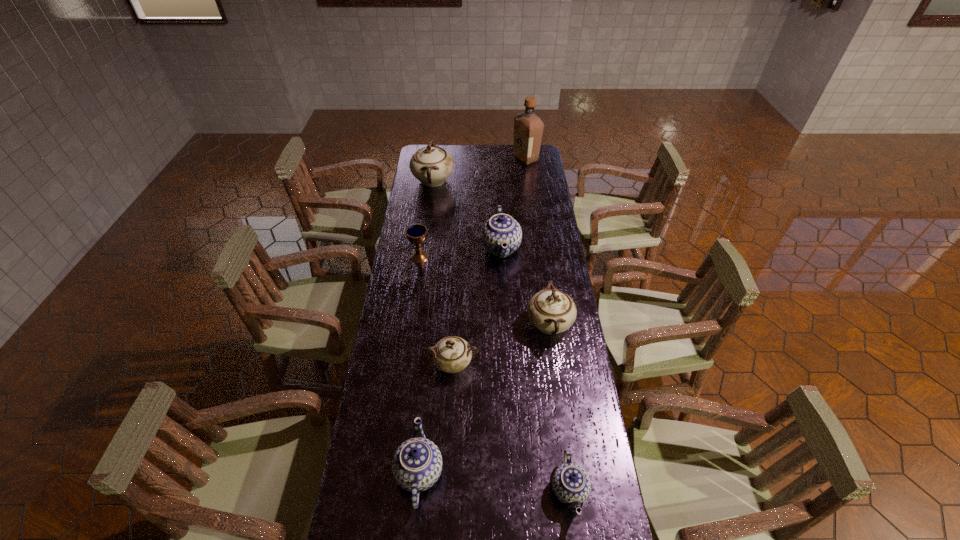
Locate an element on the screen. This screenshot has height=540, width=960. the tallest object is located at coordinates (528, 128).

Where is `liquor`? The image size is (960, 540). liquor is located at coordinates (528, 128).

The height and width of the screenshot is (540, 960). What are the coordinates of `the biggest white chinaware` in the screenshot? It's located at (431, 165).

Where is `the second tallest object`? the second tallest object is located at coordinates (431, 165).

Identify the location of the second biggest white chinaware. (551, 311).

This screenshot has width=960, height=540. What are the coordinates of `the second blue chinaware from right to left` in the screenshot? It's located at click(501, 229).

I want to click on the farthest blue chinaware, so click(x=501, y=229).

Locate an element on the screen. The height and width of the screenshot is (540, 960). blue chalice is located at coordinates (417, 233).

You are a GUI agent. You are given a task and a screenshot of the screen. Output one action in this format:
    pyautogui.click(x=<x>, y=<y>)
    Task: Click on the leftmost blue chinaware
    
    Given the screenshot: What is the action you would take?
    pyautogui.click(x=417, y=463)

The width and height of the screenshot is (960, 540). In order to click on the smallest white chinaware in this screenshot , I will do `click(452, 354)`.